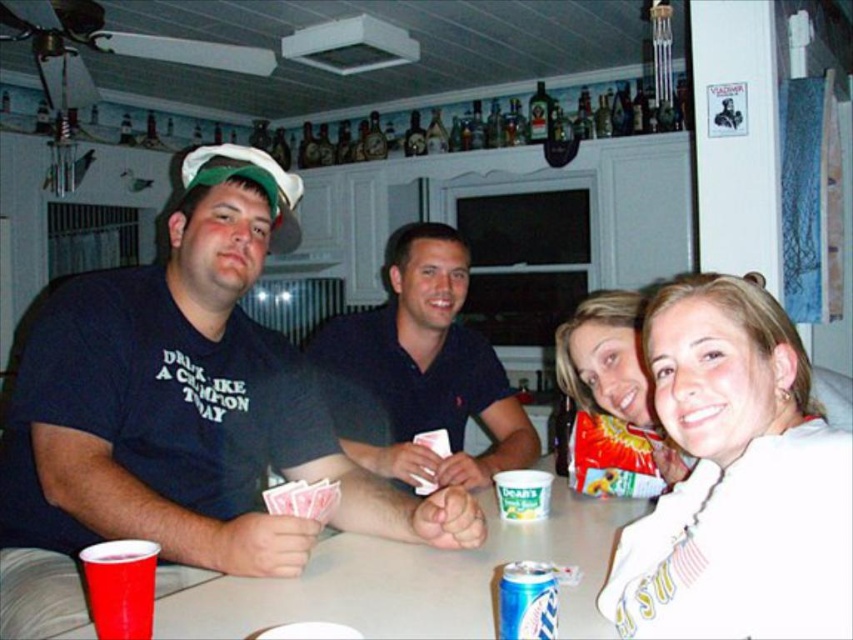
Which of these two, matte black shirt at left or dark blue polo shirt at center, stands shorter?

dark blue polo shirt at center

In the scene shown: Between matte black shirt at left and dark blue polo shirt at center, which one appears on the right side from the viewer's perspective?

dark blue polo shirt at center

Find the location of a particular element. The width and height of the screenshot is (853, 640). matte black shirt at left is located at coordinates (180, 416).

This screenshot has width=853, height=640. I want to click on matte black shirt at left, so click(180, 416).

Does white fleece sweatshirt at lower right have a lesser width compared to blue metallic can at lower center?

No.

Is white fleece sweatshirt at lower right bigger than blue metallic can at lower center?

Yes, white fleece sweatshirt at lower right is bigger than blue metallic can at lower center.

Is point (614, 611) farther from camera compared to point (555, 592)?

Yes, it is.

You are a GUI agent. You are given a task and a screenshot of the screen. Output one action in this format:
    pyautogui.click(x=<x>, y=<y>)
    Task: Click on the white fleece sweatshirt at lower right
    Image resolution: width=853 pixels, height=640 pixels.
    Given the screenshot: What is the action you would take?
    (x=735, y=480)

Does white fleece sweatshirt at lower right appear on the right side of smooth plastic cup at lower left?

Indeed, white fleece sweatshirt at lower right is positioned on the right side of smooth plastic cup at lower left.

Which is above, white fleece sweatshirt at lower right or smooth plastic cup at lower left?

white fleece sweatshirt at lower right

Between point (664, 323) and point (469, 566), which one is positioned in front?

Point (664, 323) is more forward.

I want to click on white fleece sweatshirt at lower right, so click(x=735, y=480).